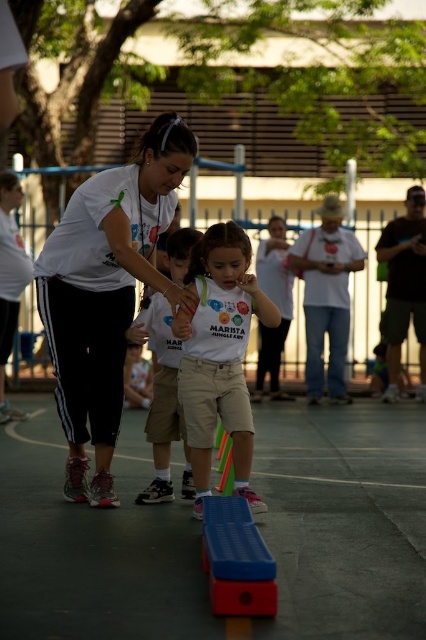
Between white matte shirt at center and white cotton shirt at center, which one has more height?

Standing taller between the two is white matte shirt at center.

Based on the photo, can you confirm if white matte shirt at center is bigger than white cotton shirt at center?

No.

Find the location of a particular element. Image resolution: width=426 pixels, height=640 pixels. white matte shirt at center is located at coordinates (219, 355).

Is point (97, 204) behind point (270, 593)?

Yes.

Identify the location of white matte t-shirt at center. (106, 292).

Is point (71, 289) behind point (273, 604)?

Yes, point (71, 289) is behind point (273, 604).

Locate an element on the screen. white matte t-shirt at center is located at coordinates (106, 292).

Can you confirm if white matte t-shirt at center is smaller than white matte shirt at center?

No.

Does white matte t-shirt at center come behind white matte shirt at center?

No.

This screenshot has height=640, width=426. I want to click on white matte t-shirt at center, so click(x=106, y=292).